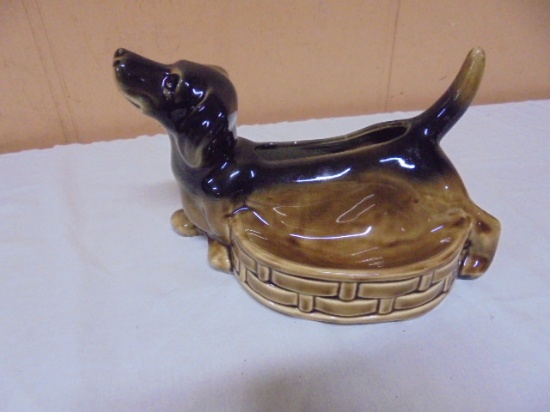
Image resolution: width=550 pixels, height=412 pixels. What are the coordinates of `wall` in the screenshot? It's located at (97, 115).